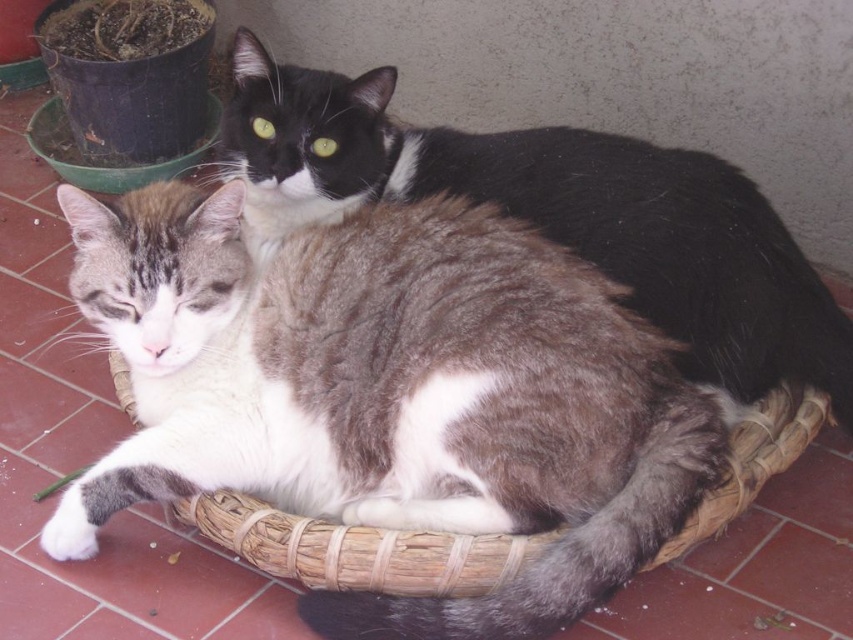
Question: Does gray and white fur cat at center appear on the left side of woven straw basket at center?

Choices:
 (A) yes
 (B) no

Answer: (B)

Question: Is gray-white fur cat at center behind gray and white fur cat at center?

Choices:
 (A) yes
 (B) no

Answer: (B)

Question: Which object is closer to the camera taking this photo?

Choices:
 (A) gray-white fur cat at center
 (B) woven straw basket at center
 (C) gray and white fur cat at center

Answer: (A)

Question: Among these points, which one is nearest to the camera?

Choices:
 (A) (518, 234)
 (B) (474, 548)

Answer: (B)

Question: Which of the following is the farthest from the observer?

Choices:
 (A) (267, 108)
 (B) (112, 500)
 (C) (265, 561)

Answer: (A)

Question: Can you confirm if gray-white fur cat at center is positioned to the right of woven straw basket at center?

Choices:
 (A) no
 (B) yes

Answer: (A)